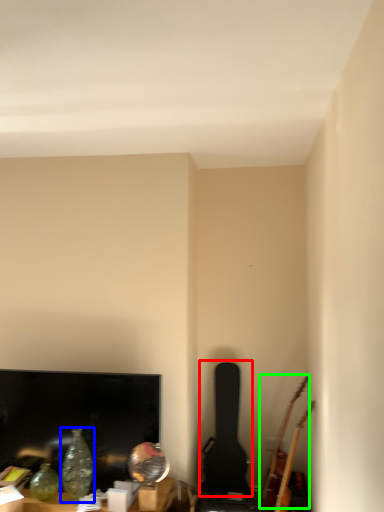
Question: Which object is positioned farthest from guitar (highlighted by a red box)? Select from glass vase (highlighted by a blue box) and guitar (highlighted by a green box).

Choices:
 (A) glass vase
 (B) guitar

Answer: (A)